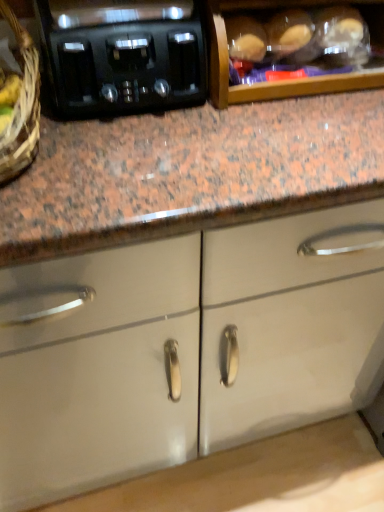
Question: Considering the relative positions of black plastic toaster at upper left and wooden cabinet at upper center, which ranks as the 2th cabinetry in back-to-front order, in the image provided, is black plastic toaster at upper left to the left of wooden cabinet at upper center, which ranks as the 2th cabinetry in back-to-front order, from the viewer's perspective?

Choices:
 (A) no
 (B) yes

Answer: (B)

Question: Is black plastic toaster at upper left not inside wooden cabinet at upper center, the second cabinetry positioned from the bottom?

Choices:
 (A) no
 (B) yes

Answer: (B)

Question: Does black plastic toaster at upper left have a lesser height compared to wooden cabinet at upper center, arranged as the 1th cabinetry when viewed from the front?

Choices:
 (A) yes
 (B) no

Answer: (A)

Question: Is black plastic toaster at upper left with wooden cabinet at upper center, arranged as the 1th cabinetry when viewed from the front?

Choices:
 (A) yes
 (B) no

Answer: (B)

Question: Is black plastic toaster at upper left smaller than wooden cabinet at upper center, which ranks as the 2th cabinetry in back-to-front order?

Choices:
 (A) no
 (B) yes

Answer: (B)

Question: From a real-world perspective, is black plastic toaster at upper left over wooden cabinet at upper center, arranged as the 1th cabinetry when viewed from the front?

Choices:
 (A) yes
 (B) no

Answer: (A)

Question: Does white glossy cabinet doors at center, placed as the first cabinetry when sorted from bottom to top, have a greater height compared to woven brown basket at left?

Choices:
 (A) no
 (B) yes

Answer: (A)

Question: Is white glossy cabinet doors at center, which is the 2th cabinetry in front-to-back order, not within woven brown basket at left?

Choices:
 (A) no
 (B) yes

Answer: (B)

Question: Does white glossy cabinet doors at center, which is the 2th cabinetry in front-to-back order, have a greater width compared to woven brown basket at left?

Choices:
 (A) no
 (B) yes

Answer: (B)

Question: Is white glossy cabinet doors at center, acting as the 2th cabinetry starting from the top, not near woven brown basket at left?

Choices:
 (A) yes
 (B) no

Answer: (B)

Question: Could you tell me if white glossy cabinet doors at center, marked as the first cabinetry in a back-to-front arrangement, is facing woven brown basket at left?

Choices:
 (A) yes
 (B) no

Answer: (B)

Question: From a real-world perspective, is white glossy cabinet doors at center, placed as the first cabinetry when sorted from bottom to top, on woven brown basket at left?

Choices:
 (A) no
 (B) yes

Answer: (A)

Question: Would you consider black plastic toaster at upper left to be distant from white glossy cabinet doors at center, marked as the first cabinetry in a back-to-front arrangement?

Choices:
 (A) yes
 (B) no

Answer: (B)